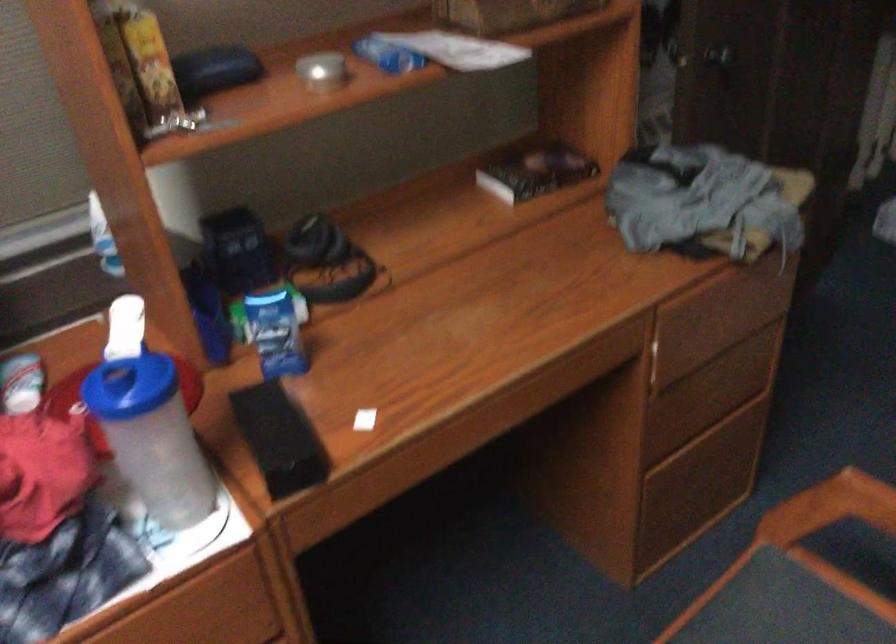
Locate an element on the screen. black book is located at coordinates coord(536,172).